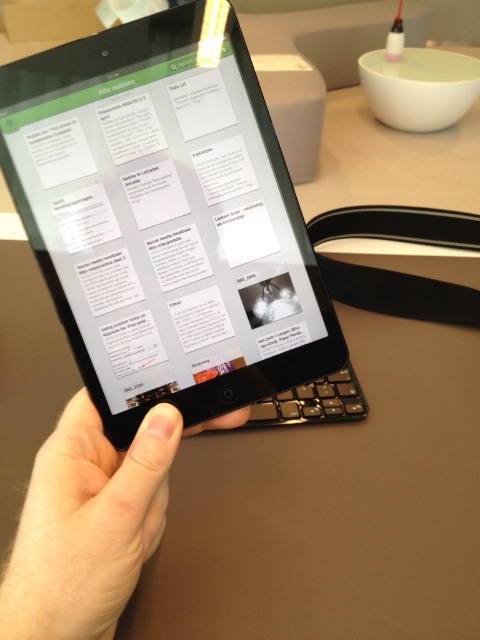
Question: Which point appears farthest from the camera in this image?

Choices:
 (A) (92, 234)
 (B) (103, 512)

Answer: (A)

Question: Does black matte tablet at center come behind skinny white finger at center?

Choices:
 (A) no
 (B) yes

Answer: (B)

Question: Does black matte tablet at center have a lesser width compared to skinny white finger at center?

Choices:
 (A) yes
 (B) no

Answer: (B)

Question: Is black matte tablet at center wider than skinny white finger at center?

Choices:
 (A) yes
 (B) no

Answer: (A)